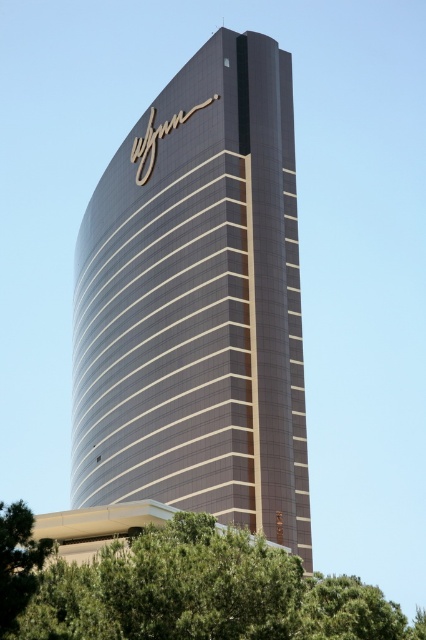
Is point (284, 188) positioned behind point (106, 637)?

Yes, point (284, 188) is farther from viewer.

Locate an element on the screen. glossy glass tower at center is located at coordinates (198, 304).